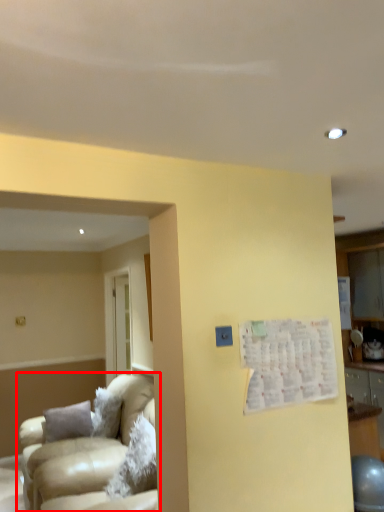
Question: From the image's perspective, what is the correct spatial positioning of studio couch (annotated by the red box) in reference to bulletin board?

Choices:
 (A) above
 (B) below

Answer: (B)